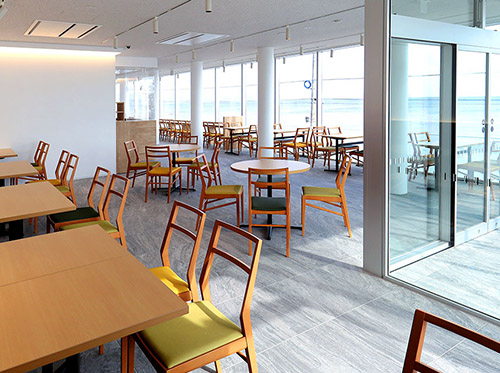
The height and width of the screenshot is (373, 500). In order to click on rectangler tables in this screenshot , I will do `click(104, 302)`, `click(72, 250)`, `click(31, 196)`, `click(12, 165)`, `click(3, 149)`, `click(467, 141)`, `click(346, 135)`, `click(281, 127)`, `click(239, 125)`.